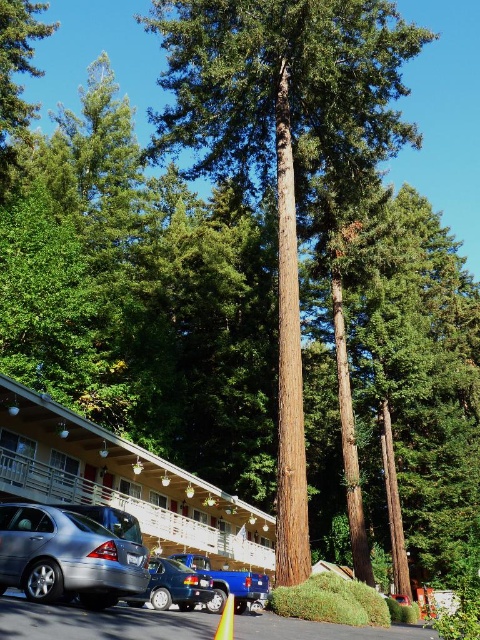
Which of these two, brown rough textured tree at center or satin silver car at lower left, stands shorter?

With less height is satin silver car at lower left.

Find the location of a particular element. brown rough textured tree at center is located at coordinates (285, 147).

Who is more forward, (408, 52) or (0, 582)?

Point (0, 582)

What are the coordinates of `brown rough textured tree at center` in the screenshot? It's located at (285, 147).

Is point (252, 588) positioned behind point (225, 618)?

Yes, it is behind point (225, 618).

Is blue metallic truck at lower center smaller than yellow reflective plastic traffic cone at lower center?

Correct, blue metallic truck at lower center occupies less space than yellow reflective plastic traffic cone at lower center.

The height and width of the screenshot is (640, 480). Find the location of `blue metallic truck at lower center`. blue metallic truck at lower center is located at coordinates (228, 582).

Where is `metallic blue sedan at lower center`? Image resolution: width=480 pixels, height=640 pixels. metallic blue sedan at lower center is located at coordinates (172, 586).

Does point (168, 568) come behind point (228, 620)?

Yes, point (168, 568) is behind point (228, 620).

Image resolution: width=480 pixels, height=640 pixels. Identify the location of metallic blue sedan at lower center. (172, 586).